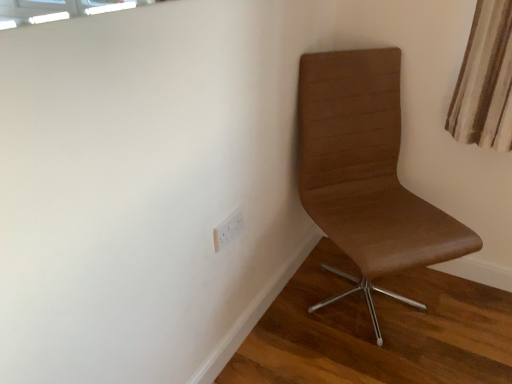
Question: Can you confirm if white plastic electric outlet at lower center is positioned to the left of brown leather chair at right?

Choices:
 (A) no
 (B) yes

Answer: (B)

Question: Would you say white plastic electric outlet at lower center contains brown leather chair at right?

Choices:
 (A) yes
 (B) no

Answer: (B)

Question: Is white plastic electric outlet at lower center in contact with brown leather chair at right?

Choices:
 (A) yes
 (B) no

Answer: (B)

Question: Is white plastic electric outlet at lower center oriented away from brown leather chair at right?

Choices:
 (A) no
 (B) yes

Answer: (A)

Question: Is white plastic electric outlet at lower center shorter than brown leather chair at right?

Choices:
 (A) yes
 (B) no

Answer: (A)

Question: Can you confirm if white plastic electric outlet at lower center is taller than brown leather chair at right?

Choices:
 (A) yes
 (B) no

Answer: (B)

Question: Could you tell me if brown leather chair at right is turned towards white plastic electric outlet at lower center?

Choices:
 (A) yes
 (B) no

Answer: (B)

Question: Does brown leather chair at right have a smaller size compared to white plastic electric outlet at lower center?

Choices:
 (A) no
 (B) yes

Answer: (A)

Question: From the image's perspective, would you say brown leather chair at right is shown under white plastic electric outlet at lower center?

Choices:
 (A) yes
 (B) no

Answer: (B)

Question: Is brown leather chair at right oriented away from white plastic electric outlet at lower center?

Choices:
 (A) no
 (B) yes

Answer: (A)

Question: Is brown leather chair at right at the right side of white plastic electric outlet at lower center?

Choices:
 (A) yes
 (B) no

Answer: (A)

Question: Are brown leather chair at right and white plastic electric outlet at lower center far apart?

Choices:
 (A) no
 (B) yes

Answer: (A)

Question: In the image, is white plastic electric outlet at lower center on the left side or the right side of brown leather chair at right?

Choices:
 (A) left
 (B) right

Answer: (A)